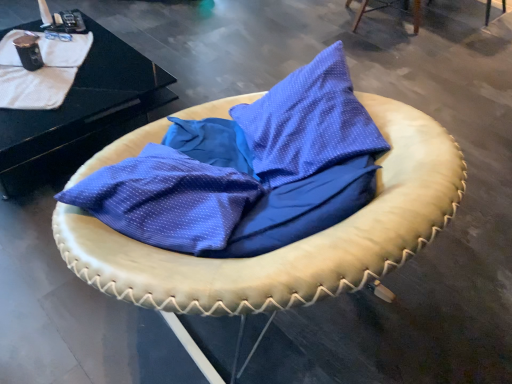
Question: Does black glossy table at upper left have a lesser width compared to leather cushion at center, the second furniture positioned from the top?

Choices:
 (A) yes
 (B) no

Answer: (A)

Question: From a real-world perspective, is black glossy table at upper left on top of leather cushion at center, the second furniture when ordered from right to left?

Choices:
 (A) no
 (B) yes

Answer: (A)

Question: Does black glossy table at upper left have a lesser height compared to leather cushion at center, the 1th furniture from the left?

Choices:
 (A) yes
 (B) no

Answer: (A)

Question: Does black glossy table at upper left appear on the left side of leather cushion at center, which is the 1th furniture in front-to-back order?

Choices:
 (A) yes
 (B) no

Answer: (A)

Question: Considering the relative positions of black glossy table at upper left and leather cushion at center, the second furniture when ordered from right to left, in the image provided, is black glossy table at upper left in front of leather cushion at center, the second furniture when ordered from right to left,?

Choices:
 (A) yes
 (B) no

Answer: (B)

Question: Is leather cushion at center, which is the 1th furniture in front-to-back order, spatially inside leather cushion at upper right, the second furniture positioned from the left, or outside of it?

Choices:
 (A) outside
 (B) inside

Answer: (A)

Question: In the image, is leather cushion at center, which is the 1th furniture in front-to-back order, on the left side or the right side of leather cushion at upper right, the 2th furniture viewed from the front?

Choices:
 (A) right
 (B) left

Answer: (B)

Question: Is leather cushion at center, the 1th furniture from the left, in front of or behind leather cushion at upper right, the 2th furniture viewed from the front, in the image?

Choices:
 (A) behind
 (B) front

Answer: (B)

Question: Is leather cushion at center, positioned as the second furniture in back-to-front order, taller or shorter than leather cushion at upper right, the 2th furniture viewed from the front?

Choices:
 (A) short
 (B) tall

Answer: (B)

Question: From a real-world perspective, is leather cushion at center, placed as the first furniture when sorted from bottom to top, positioned above or below black glossy table at upper left?

Choices:
 (A) above
 (B) below

Answer: (A)

Question: Looking at the image, does leather cushion at center, the 1th furniture from the left, seem bigger or smaller compared to black glossy table at upper left?

Choices:
 (A) big
 (B) small

Answer: (A)

Question: Is point (409, 129) closer or farther from the camera than point (115, 36)?

Choices:
 (A) closer
 (B) farther

Answer: (A)

Question: In terms of height, does leather cushion at center, placed as the first furniture when sorted from bottom to top, look taller or shorter compared to black glossy table at upper left?

Choices:
 (A) short
 (B) tall

Answer: (B)

Question: Is leather cushion at upper right, positioned as the second furniture in bottom-to-top order, inside or outside of white textured blanket at upper left?

Choices:
 (A) inside
 (B) outside

Answer: (B)

Question: Looking at the image, does leather cushion at upper right, the second furniture positioned from the left, seem bigger or smaller compared to white textured blanket at upper left?

Choices:
 (A) small
 (B) big

Answer: (B)